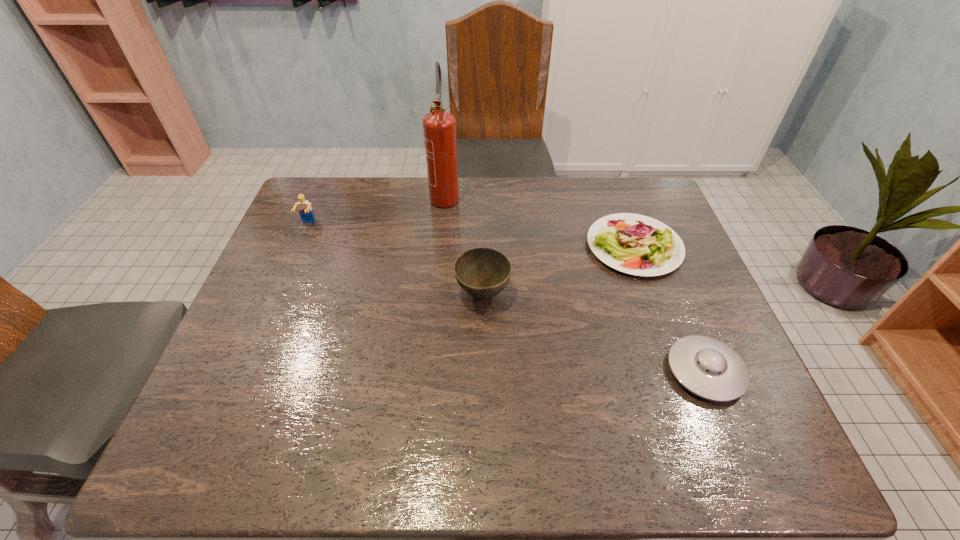
In the image, there is a desktop. In order to click on free space at the near edge in this screenshot , I will do `click(493, 463)`.

The width and height of the screenshot is (960, 540). I want to click on free space at the left edge of the desktop, so click(277, 374).

This screenshot has height=540, width=960. In the image, there is a desktop. What are the coordinates of `vacant area at the right edge` in the screenshot? It's located at (728, 342).

At what (x,y) coordinates should I click in order to perform the action: click on vacant space at the far left corner. Please return your answer as a coordinate pair (x, y). Looking at the image, I should click on (339, 198).

In the image, there is a desktop. In order to click on free space at the near right corner in this screenshot , I will do `click(707, 453)`.

Identify the location of free space between the salad plate and the Lego. This screenshot has width=960, height=540. (471, 235).

This screenshot has width=960, height=540. In order to click on unoccupied position between the salad plate and the third object from left to right in this screenshot , I will do `click(559, 270)`.

Find the location of a particular element. This screenshot has height=540, width=960. empty space that is in between the third object from right to left and the nearest object is located at coordinates (594, 333).

Where is `free space that is in between the Lego and the salad plate`? The height and width of the screenshot is (540, 960). free space that is in between the Lego and the salad plate is located at coordinates (471, 235).

Locate an element on the screen. Image resolution: width=960 pixels, height=540 pixels. empty space between the Lego and the bowl is located at coordinates (396, 259).